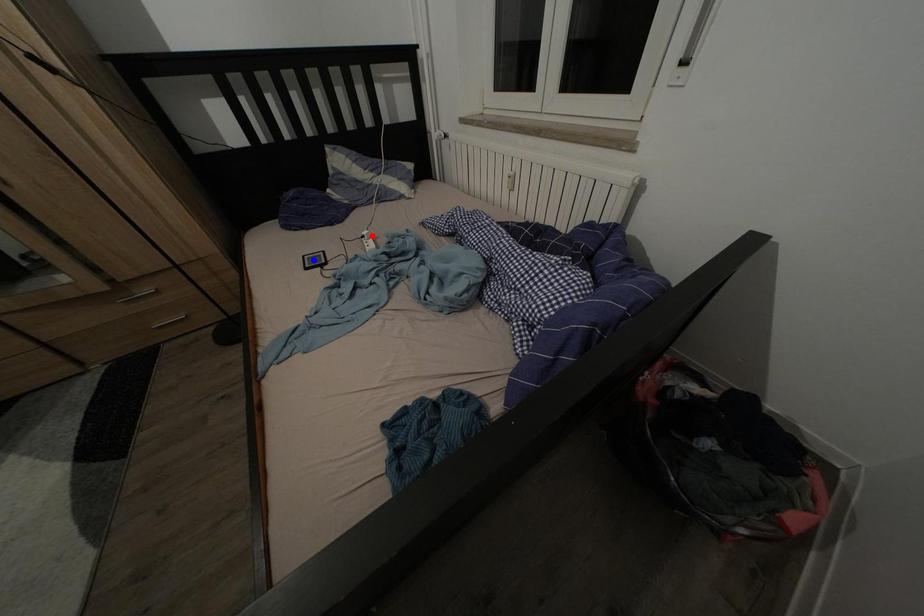
Question: In the image, two points are highlighted. Which point is nearer to the camera? Reply with the corresponding letter.

Choices:
 (A) blue point
 (B) red point

Answer: (B)